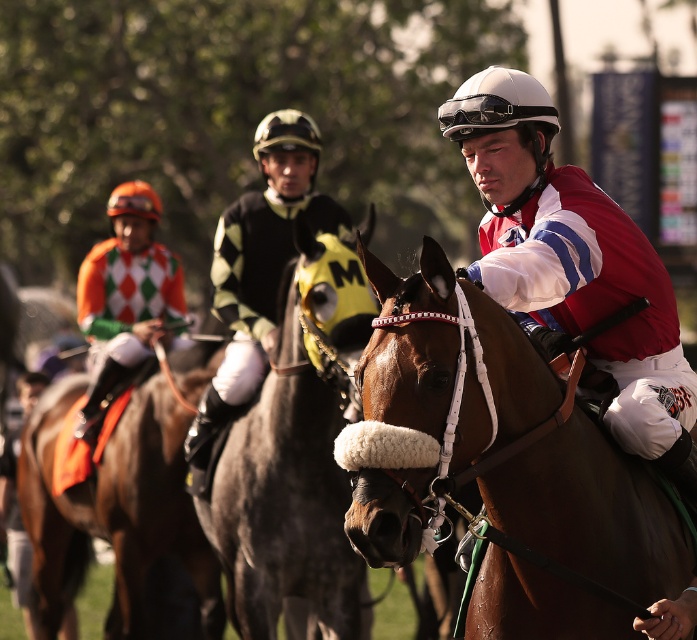
Which is more to the right, brown glossy saddle at left or matte black helmet at center?

matte black helmet at center

Which is in front, point (107, 470) or point (217, 387)?

Point (217, 387) is in front.

The height and width of the screenshot is (640, 697). What are the coordinates of `brown glossy saddle at left` in the screenshot? It's located at (114, 508).

How far apart are brown glossy horse at center and brown glossy saddle at left?

brown glossy horse at center and brown glossy saddle at left are 16.41 feet apart.

The image size is (697, 640). What do you see at coordinates (429, 400) in the screenshot?
I see `brown glossy horse at center` at bounding box center [429, 400].

Is point (562, 493) behind point (82, 566)?

No, (562, 493) is closer to viewer.

Where is `brown glossy horse at center`? This screenshot has width=697, height=640. brown glossy horse at center is located at coordinates (429, 400).

Is the position of matte red jacket at center less distant than that of brown glossy saddle at left?

Yes, matte red jacket at center is closer to the viewer.

Is matte red jacket at center to the left of brown glossy saddle at left from the viewer's perspective?

No, matte red jacket at center is not to the left of brown glossy saddle at left.

Who is more forward, (x=482, y=122) or (x=123, y=596)?

Point (x=482, y=122)

The width and height of the screenshot is (697, 640). Identify the location of matte red jacket at center. (574, 268).